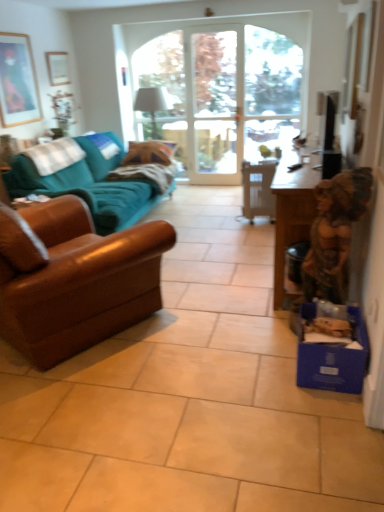
Where is `empty space that is in between brown leather couch at left, the first studio couch in the front-to-back sequence, and blue cardboard box at lower right`? This screenshot has height=512, width=384. empty space that is in between brown leather couch at left, the first studio couch in the front-to-back sequence, and blue cardboard box at lower right is located at coordinates (206, 359).